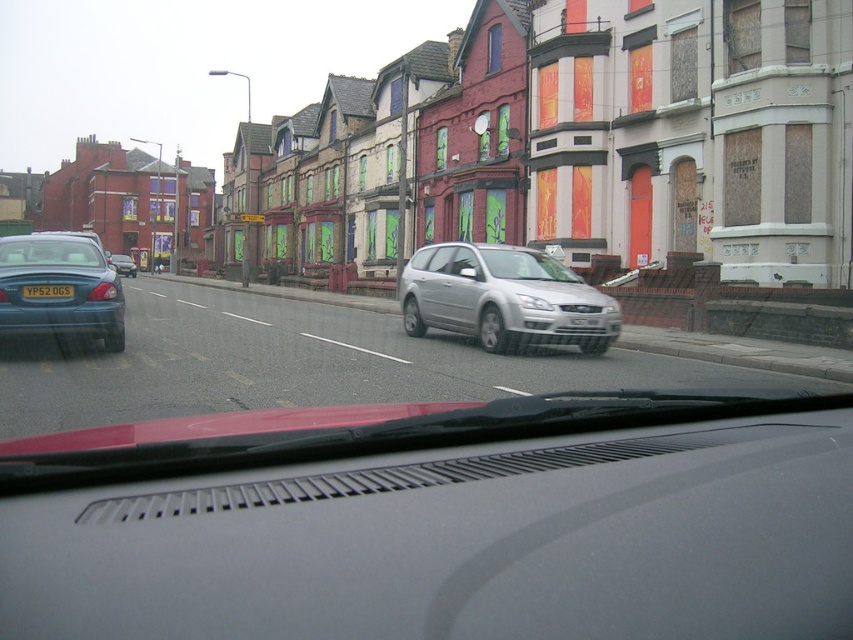
Does silver metallic station wagon at center have a larger size compared to matte blue car at left?

Correct, silver metallic station wagon at center is larger in size than matte blue car at left.

Locate an element on the screen. silver metallic station wagon at center is located at coordinates (503, 298).

Where is `silver metallic station wagon at center`? silver metallic station wagon at center is located at coordinates (503, 298).

The height and width of the screenshot is (640, 853). In order to click on silver metallic station wagon at center in this screenshot , I will do `click(503, 298)`.

Does gray matte dashboard at center lie behind matte blue car at left?

No, it is in front of matte blue car at left.

Locate an element on the screen. This screenshot has height=640, width=853. gray matte dashboard at center is located at coordinates (439, 522).

This screenshot has height=640, width=853. Find the location of `matte black car at left`. matte black car at left is located at coordinates (59, 288).

What do you see at coordinates (59, 288) in the screenshot? I see `matte black car at left` at bounding box center [59, 288].

Does point (4, 269) come behind point (67, 285)?

That is True.

Locate an element on the screen. The image size is (853, 640). matte black car at left is located at coordinates (59, 288).